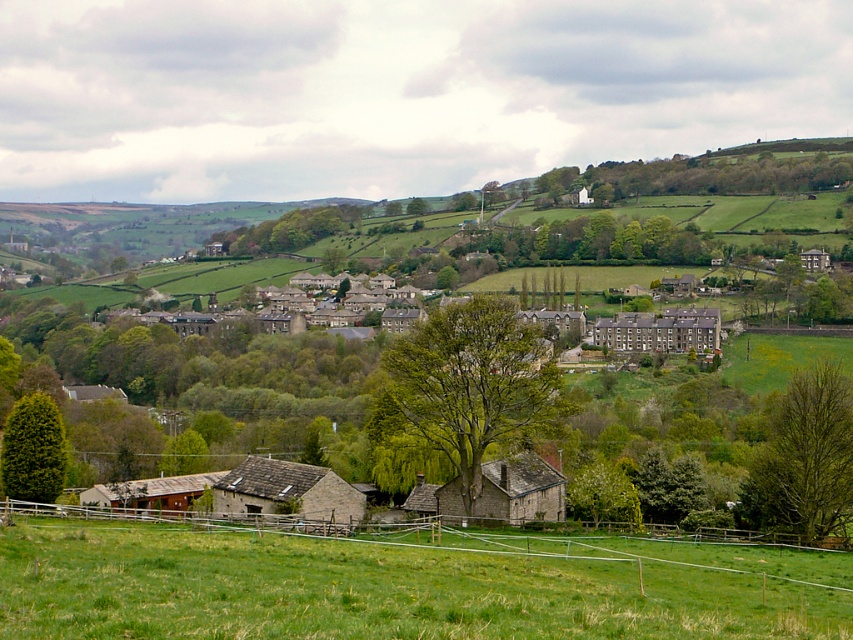
From the picture: Based on the provided scene description, where is the green grassy field at lower center located in terms of its 2D coordinates?

The green grassy field at lower center is located at the 2D coordinates of point (396,586).